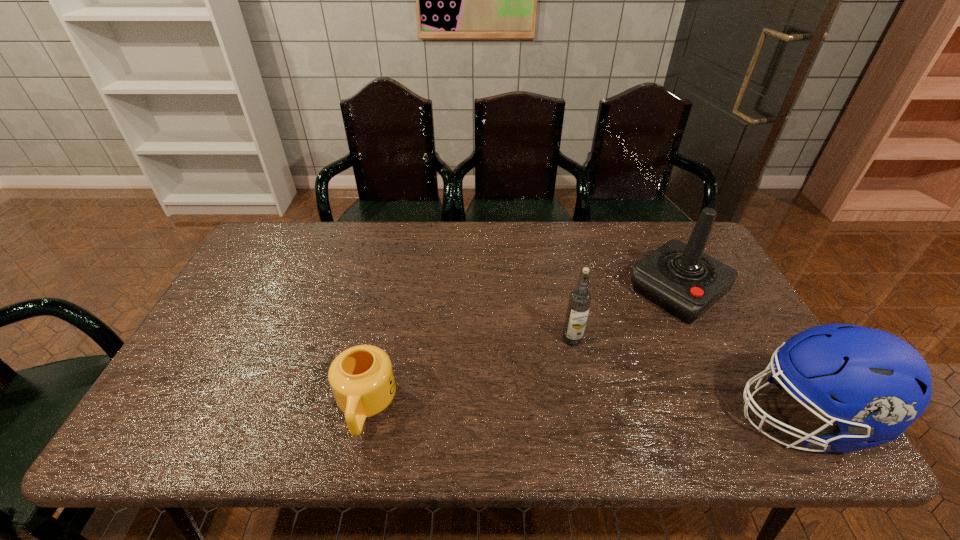
Locate an element on the screen. vacant area in the image that satisfies the following two spatial constraints: 1. on the back side of the joystick; 2. on the left side of the third nearest object is located at coordinates (563, 292).

At what (x,y) coordinates should I click in order to perform the action: click on free space in the image that satisfies the following two spatial constraints: 1. on the front side of the football helmet; 2. on the front-facing side of the second object from left to right. Please return your answer as a coordinate pair (x, y). Image resolution: width=960 pixels, height=540 pixels. Looking at the image, I should click on (588, 418).

Where is `free space that satisfies the following two spatial constraints: 1. on the handle side of the football helmet; 2. on the front-facing side of the mug`? Image resolution: width=960 pixels, height=540 pixels. free space that satisfies the following two spatial constraints: 1. on the handle side of the football helmet; 2. on the front-facing side of the mug is located at coordinates (364, 418).

In order to click on vacant space that satisfies the following two spatial constraints: 1. on the handle side of the football helmet; 2. on the front-facing side of the shortest object in this screenshot , I will do `click(364, 418)`.

You are a GUI agent. You are given a task and a screenshot of the screen. Output one action in this format:
    pyautogui.click(x=<x>, y=<y>)
    Task: Click on the free spot that satisfies the following two spatial constraints: 1. on the handle side of the shortest object; 2. on the front-facing side of the football helmet
    This screenshot has height=540, width=960.
    Given the screenshot: What is the action you would take?
    pyautogui.click(x=364, y=418)